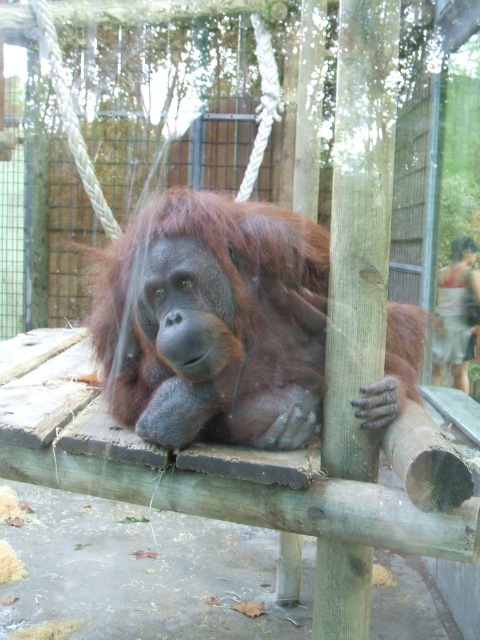
Question: Estimate the real-world distances between objects in this image. Which object is closer to the greenish-brown wood pole at right?

Choices:
 (A) brown furry orangutan at center
 (B) light brown fabric shorts at lower right

Answer: (A)

Question: Which object is closer to the camera taking this photo?

Choices:
 (A) light brown fabric shorts at lower right
 (B) brown furry orangutan at center

Answer: (B)

Question: In this image, where is brown furry orangutan at center located relative to light brown fabric shorts at lower right?

Choices:
 (A) above
 (B) below

Answer: (B)

Question: Which is nearer to the brown furry orangutan at center?

Choices:
 (A) greenish-brown wood pole at right
 (B) light brown fabric shorts at lower right

Answer: (A)

Question: Is brown furry orangutan at center positioned at the back of greenish-brown wood pole at right?

Choices:
 (A) no
 (B) yes

Answer: (B)

Question: Is brown furry orangutan at center bigger than greenish-brown wood pole at right?

Choices:
 (A) no
 (B) yes

Answer: (B)